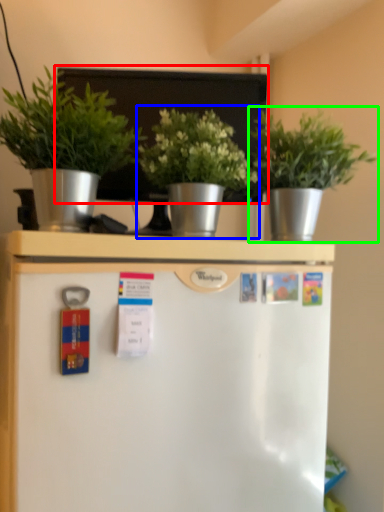
Question: Which object is positioned farthest from bulletin board (highlighted by a red box)? Select from houseplant (highlighted by a blue box) and houseplant (highlighted by a green box).

Choices:
 (A) houseplant
 (B) houseplant

Answer: (B)